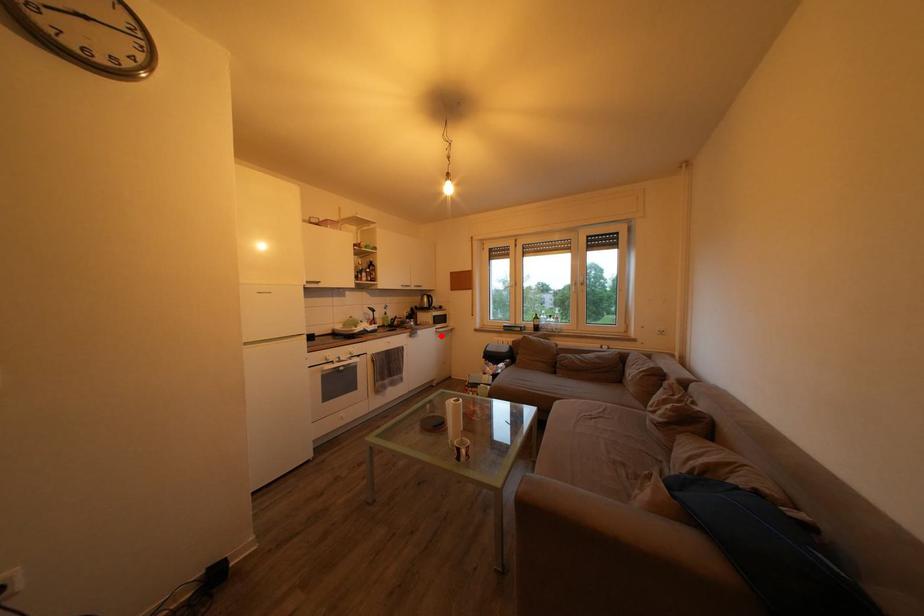
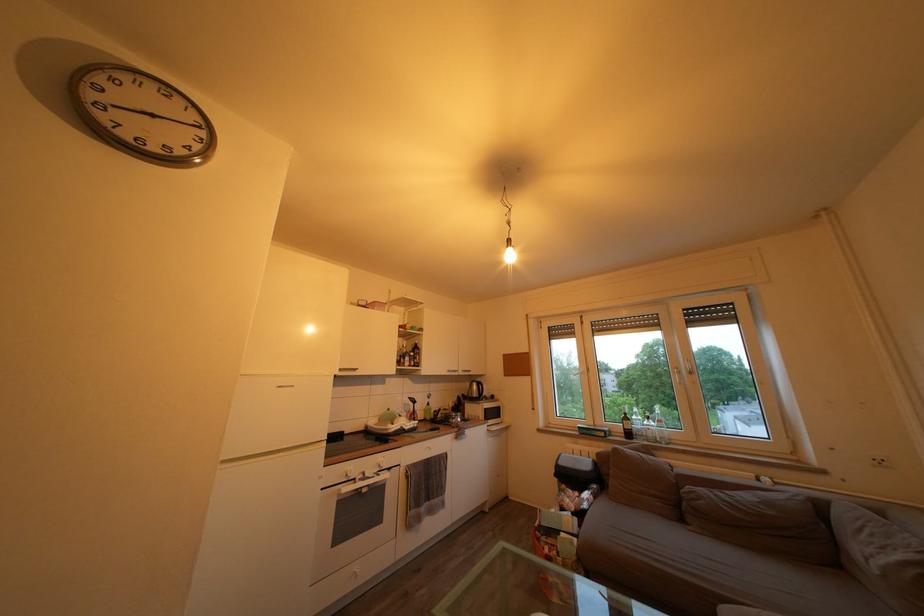
In the second image, find the point that corresponds to the highlighted location in the first image.

(492, 434)